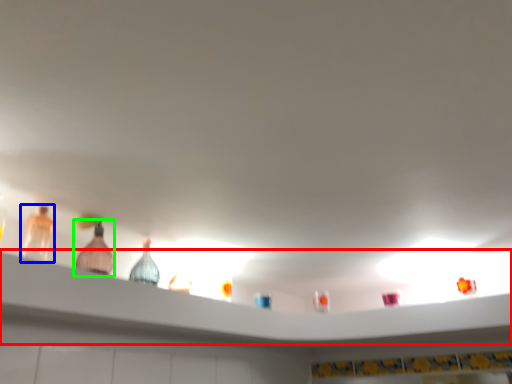
Question: Which is nearer to the shelf (highlighted by a red box)? bottle (highlighted by a blue box) or bottle (highlighted by a green box).

Choices:
 (A) bottle
 (B) bottle

Answer: (B)